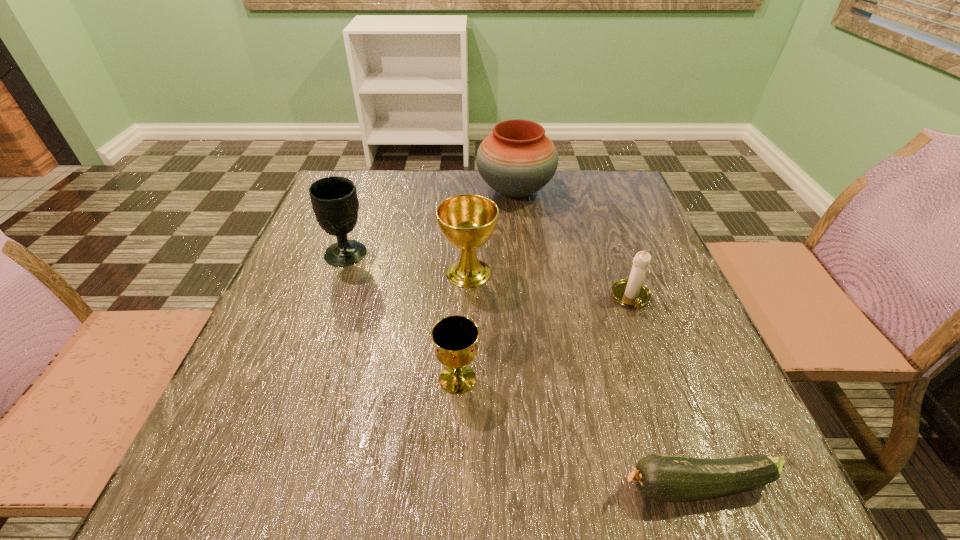
This screenshot has width=960, height=540. Identify the location of pottery. (516, 160).

Locate an element on the screen. This screenshot has width=960, height=540. the leftmost object is located at coordinates (334, 199).

Identify the location of candle holder. This screenshot has height=540, width=960. (631, 292).

At what (x,y) coordinates should I click in order to perform the action: click on the second nearest object. Please return your answer as a coordinate pair (x, y). The width and height of the screenshot is (960, 540). Looking at the image, I should click on (455, 337).

Where is `the shortest chalice`? This screenshot has width=960, height=540. the shortest chalice is located at coordinates (455, 337).

This screenshot has height=540, width=960. I want to click on the nearest object, so 668,478.

In order to click on zucchini in this screenshot , I will do `click(668, 478)`.

Identify the location of free region located 0.120m on the front of the pottery. (520, 241).

The height and width of the screenshot is (540, 960). I want to click on free region located on the right of the leftmost object, so click(x=480, y=253).

Locate an element on the screen. vacant area located 0.070m on the handle side of the candle holder is located at coordinates (647, 342).